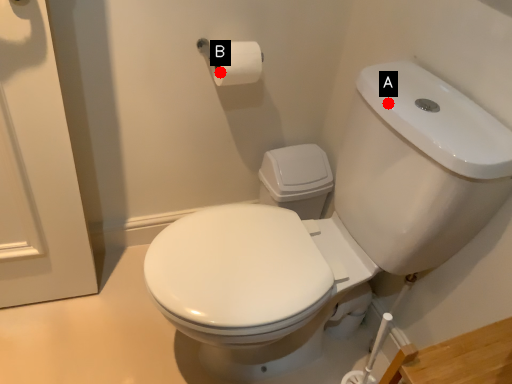
Question: Two points are circled on the image, labeled by A and B beside each circle. Which of the following is the farthest from the observer?

Choices:
 (A) A is further
 (B) B is further

Answer: (B)